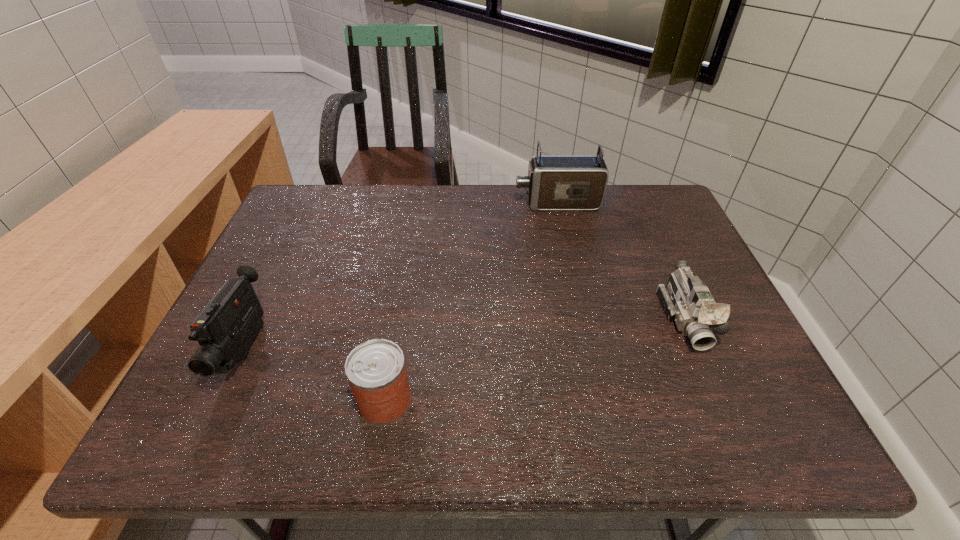
The width and height of the screenshot is (960, 540). Find the location of `blank space located on the front-facing side of the second tallest camcorder`. blank space located on the front-facing side of the second tallest camcorder is located at coordinates click(199, 444).

Locate an element on the screen. free space located on the front-facing side of the rightmost camcorder is located at coordinates (726, 414).

Find the location of a particular element. vacant space located on the left of the can is located at coordinates (253, 401).

At what (x,y) coordinates should I click in order to perform the action: click on object that is at the far edge. Please return your answer as a coordinate pair (x, y). Looking at the image, I should click on (554, 182).

The height and width of the screenshot is (540, 960). Identify the location of object located at the near edge. (376, 371).

Locate an element on the screen. The height and width of the screenshot is (540, 960). object that is at the left edge is located at coordinates (226, 327).

The height and width of the screenshot is (540, 960). I want to click on object that is at the right edge, so click(x=686, y=300).

You are a GUI agent. You are given a task and a screenshot of the screen. Output one action in this format:
    pyautogui.click(x=<x>, y=<y>)
    Task: Click on the vacant space at the far edge of the desktop
    
    Given the screenshot: What is the action you would take?
    pyautogui.click(x=444, y=215)

In the image, there is a desktop. In order to click on free space at the near edge in this screenshot , I will do `click(561, 436)`.

You are a GUI agent. You are given a task and a screenshot of the screen. Output one action in this format:
    pyautogui.click(x=<x>, y=<y>)
    Task: Click on the vacant area at the left edge
    
    Given the screenshot: What is the action you would take?
    pyautogui.click(x=327, y=235)